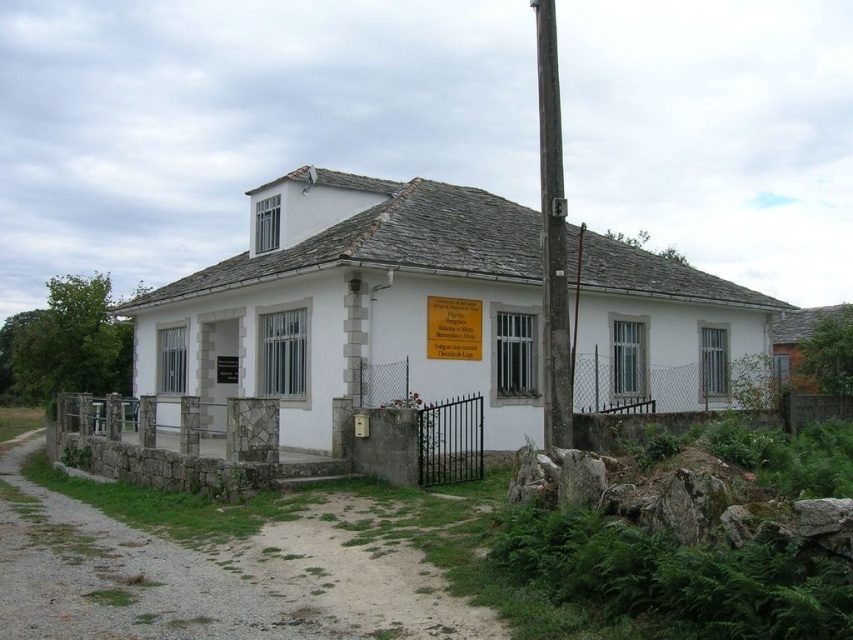
Is smooth wooden pole at right to the left of wooden plaque at center from the viewer's perspective?

No, smooth wooden pole at right is not to the left of wooden plaque at center.

Does point (544, 124) come closer to viewer compared to point (463, 337)?

Yes, point (544, 124) is in front of point (463, 337).

In order to click on smooth wooden pole at right in this screenshot , I will do `click(552, 237)`.